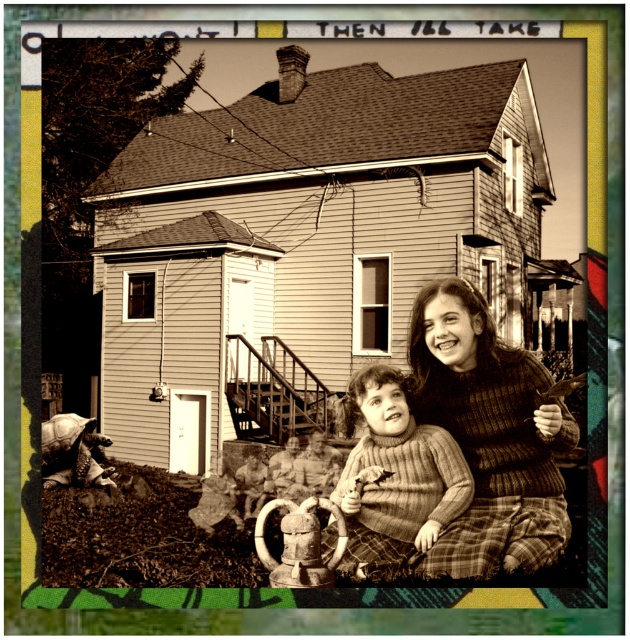
You are standing in front of the house in the image and see two points marked on the image. Which point, point [464,458] or point [421,493], is closer to you?

Point [464,458] is closer to you because it is further to the viewer than point [421,493].